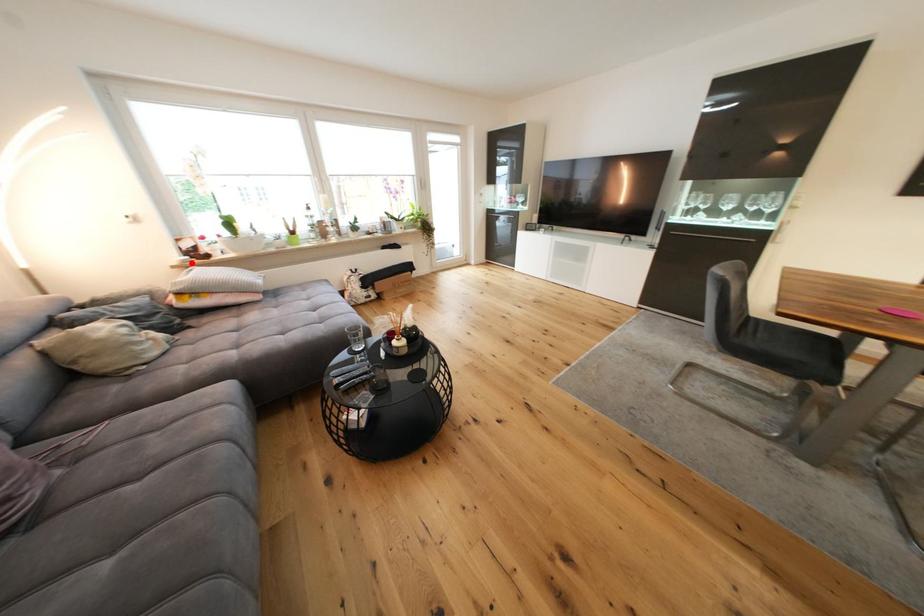
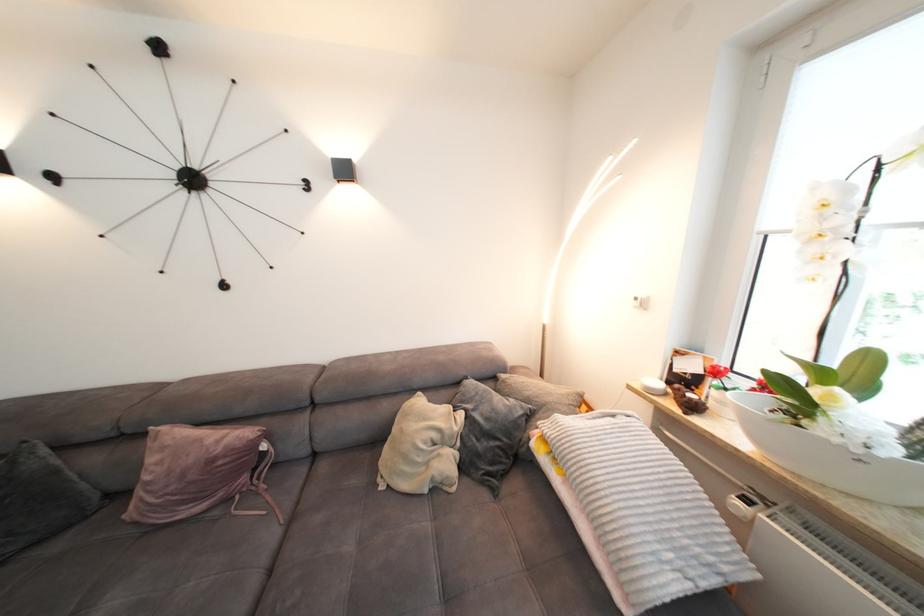
Locate, in the second image, the point that corresponds to the highlighted location in the first image.

(657, 391)